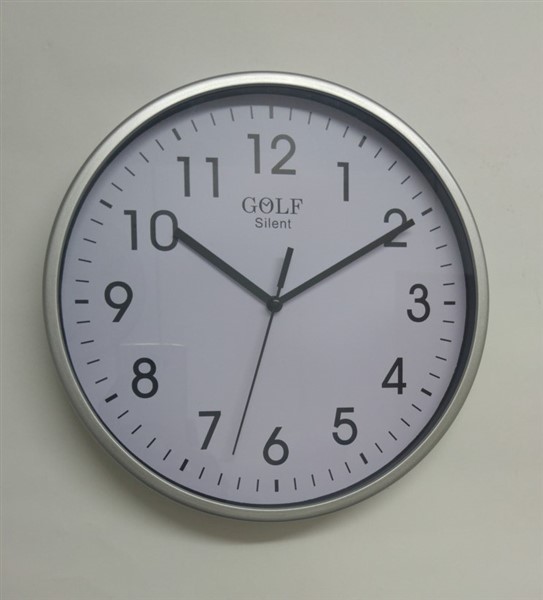
At what (x,y) coordinates should I click in order to perform the action: click on wall. Please return your answer as a coordinate pair (x, y). This screenshot has width=543, height=600. Looking at the image, I should click on (413, 556).